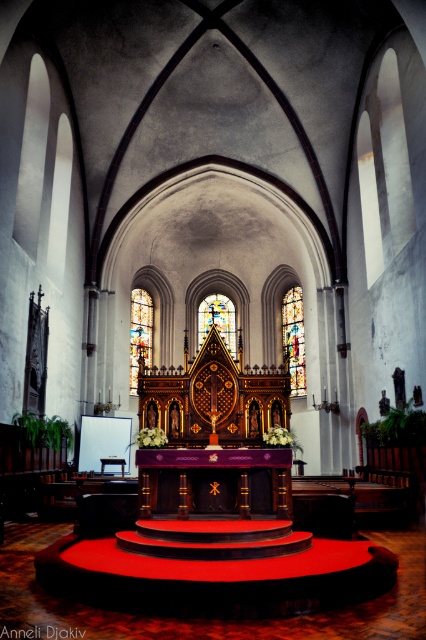
Does stained glass at upper center lie in front of stained glass window at center?

No, stained glass at upper center is further to the viewer.

Is stained glass at upper center to the left of stained glass window at center from the viewer's perspective?

Incorrect, stained glass at upper center is not on the left side of stained glass window at center.

Is point (296, 298) farther from camera compared to point (215, 298)?

No, it is not.

At what (x,y) coordinates should I click in order to perform the action: click on stained glass at upper center. Please return your answer as a coordinate pair (x, y). This screenshot has width=426, height=640. Looking at the image, I should click on (293, 339).

Is the position of stained glass at center more distant than that of stained glass window at center?

Yes, it is.

Which is behind, point (135, 369) or point (230, 305)?

Point (230, 305)

The height and width of the screenshot is (640, 426). Find the location of `stained glass at center`. stained glass at center is located at coordinates (140, 333).

Between stained glass at upper center and stained glass at center, which one appears on the right side from the viewer's perspective?

Positioned to the right is stained glass at upper center.

Is stained glass at upper center above stained glass at center?

Indeed, stained glass at upper center is positioned over stained glass at center.

Where is `stained glass at upper center`? The height and width of the screenshot is (640, 426). stained glass at upper center is located at coordinates (293, 339).